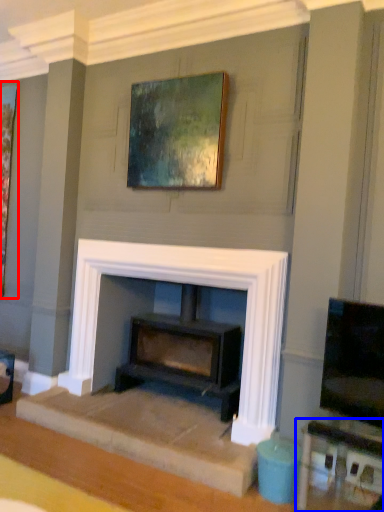
Question: Which point is closer to the camera, picture frame (highlighted by a red box) or table (highlighted by a blue box)?

Choices:
 (A) picture frame
 (B) table

Answer: (B)